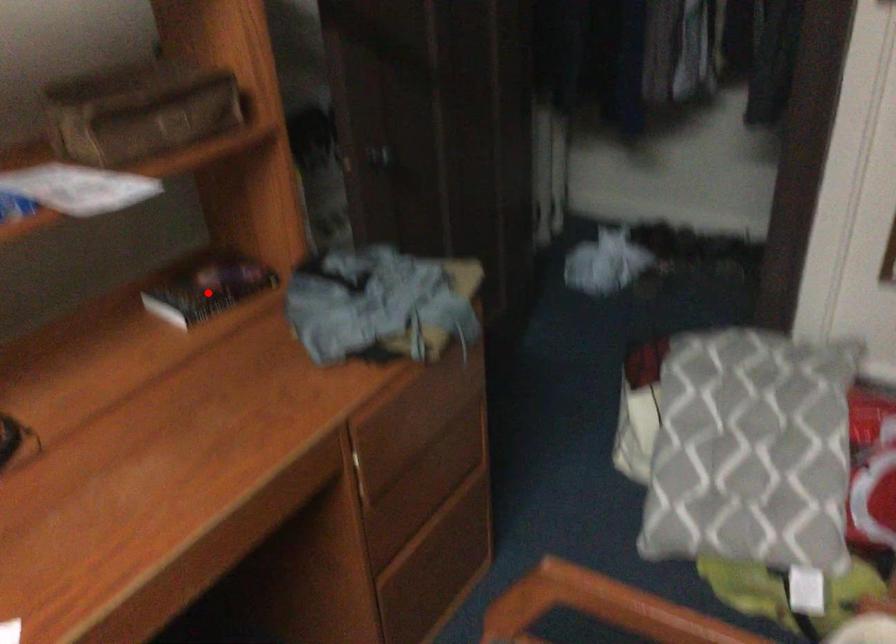
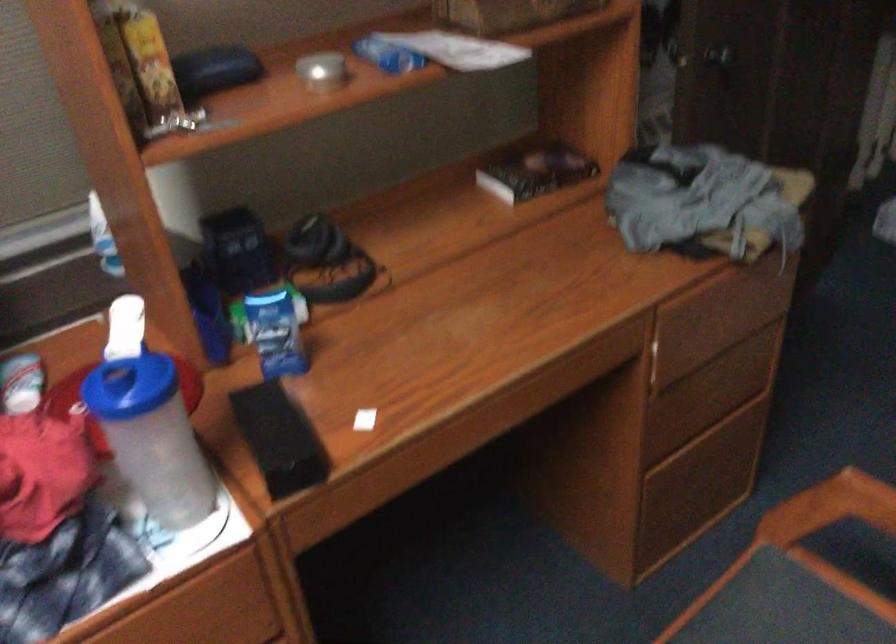
Where in the second image is the point corresponding to the highlighted location from the first image?

(536, 172)